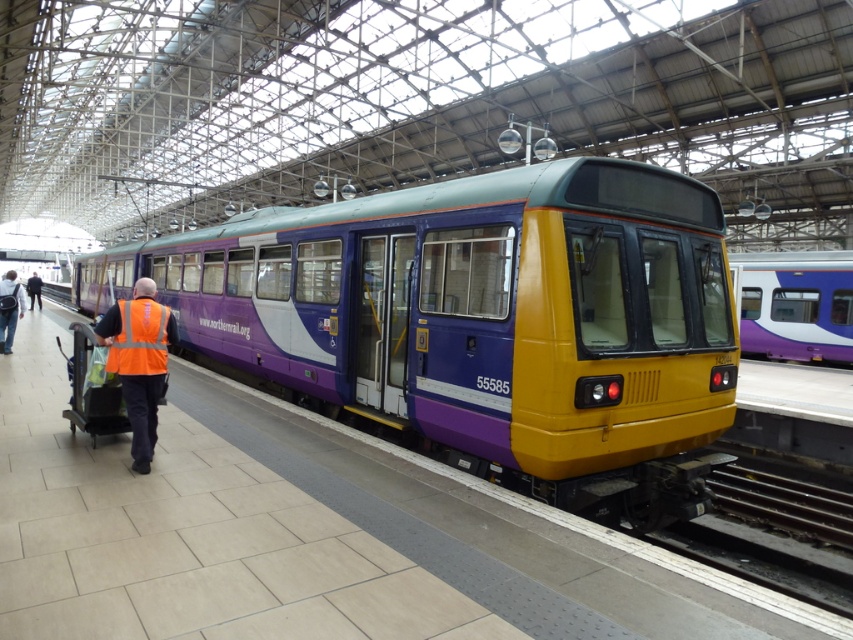
Question: Is matte purple train at right to the left of high visibility orange vest at center from the viewer's perspective?

Choices:
 (A) yes
 (B) no

Answer: (B)

Question: Which is farther from the metallic steel train track at lower right?

Choices:
 (A) reflective orange vest at left
 (B) orange reflective vest at left
 (C) matte purple train at right

Answer: (B)

Question: Considering the real-world distances, which object is closest to the high visibility orange vest at center?

Choices:
 (A) matte purple train at right
 (B) metallic steel train track at lower right
 (C) reflective orange vest at left
 (D) purple glossy train at center

Answer: (B)

Question: Is purple glossy train at center closer to camera compared to high visibility orange vest at center?

Choices:
 (A) yes
 (B) no

Answer: (A)

Question: Is metallic steel train track at lower right positioned before matte purple train at right?

Choices:
 (A) yes
 (B) no

Answer: (A)

Question: Among these points, which one is farthest from the camera?

Choices:
 (A) (799, 285)
 (B) (712, 481)

Answer: (A)